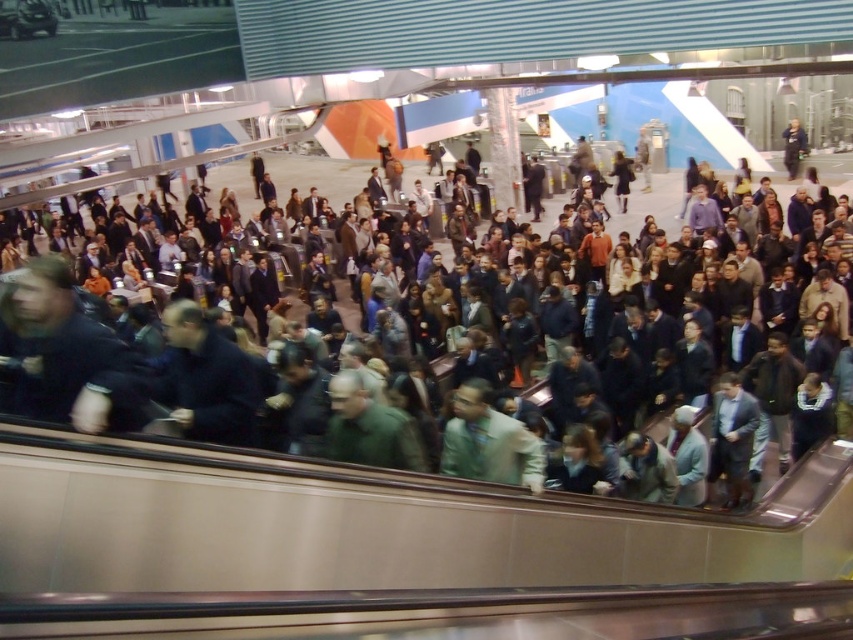
You are a photographer trying to capture a candid shot of the light beige fabric shirt at center and the dark gray jacket at center in the crowded escalator scene. Since the escalator is moving upwards, you need to position yourself to avoid blurring the subjects. Considering their heights, which subject should you focus on first to ensure both are in frame without moving your camera position?

The light beige fabric shirt at center has a lesser height compared to dark gray jacket at center, so you should focus on the light beige fabric shirt at center first to ensure it stays in frame while the dark gray jacket at center remains visible above it.

You are a person standing on the crowded escalator in the subway station. You see a light beige fabric shirt at center and a dark gray jacket at center. Can you comfortably walk between them?

The light beige fabric shirt at center and dark gray jacket at center are 20.89 feet apart, so yes, you can comfortably walk between them as the distance is more than enough for a person to pass through.